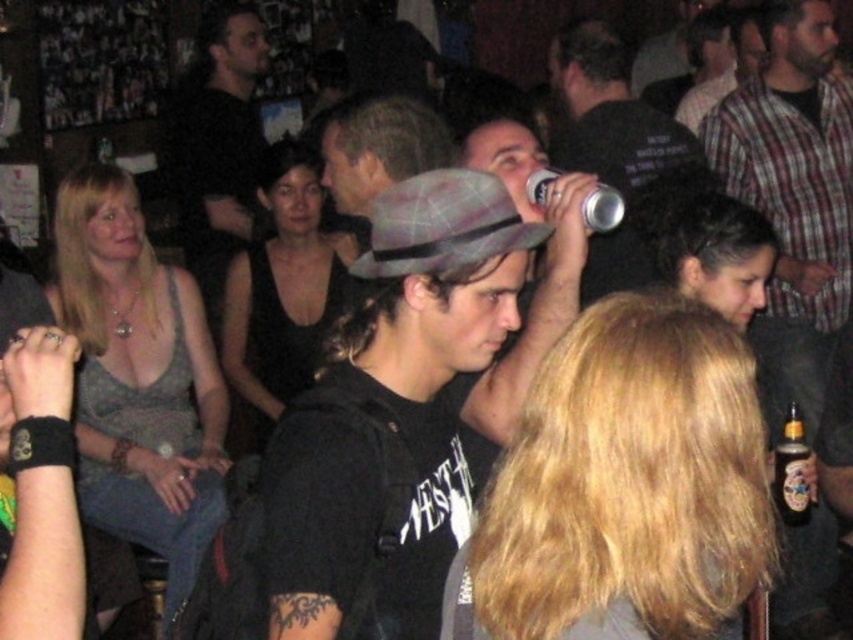
Question: Is plaid fabric fedora at center to the right of plaid shirt at center from the viewer's perspective?

Choices:
 (A) yes
 (B) no

Answer: (B)

Question: Which point appears closest to the camera in this image?

Choices:
 (A) (193, 268)
 (B) (393, 237)

Answer: (B)

Question: Can you confirm if plaid fabric fedora at center is positioned above silver metallic can at upper center?

Choices:
 (A) yes
 (B) no

Answer: (B)

Question: Estimate the real-world distances between objects in this image. Which object is farther from the amber glass bottle at lower right?

Choices:
 (A) plaid fabric fedora at center
 (B) silver metallic can at upper center

Answer: (A)

Question: Which point is farther from the camera taking this photo?

Choices:
 (A) (781, 451)
 (B) (212, 141)
 (C) (614, 198)

Answer: (B)

Question: Does plaid fabric fedora at center have a lesser width compared to amber glass bottle at lower right?

Choices:
 (A) no
 (B) yes

Answer: (A)